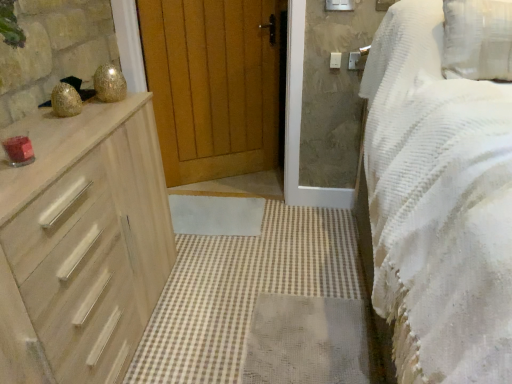
Question: From their relative heights in the image, would you say white textured bed at right is taller or shorter than white plastic light switch at upper right?

Choices:
 (A) tall
 (B) short

Answer: (A)

Question: Considering the positions of white textured bed at right and white plastic light switch at upper right in the image, is white textured bed at right wider or thinner than white plastic light switch at upper right?

Choices:
 (A) wide
 (B) thin

Answer: (A)

Question: Which of these objects is positioned farthest from the wooden drawers at left?

Choices:
 (A) white plastic light switch at upper right
 (B) wooden at center
 (C) white textured bed at right
 (D) light wood chest of drawers at left

Answer: (A)

Question: Based on their relative distances, which object is farther from the wooden drawers at left?

Choices:
 (A) light wood chest of drawers at left
 (B) white plastic light switch at upper right
 (C) wooden at center
 (D) white textured bed at right

Answer: (B)